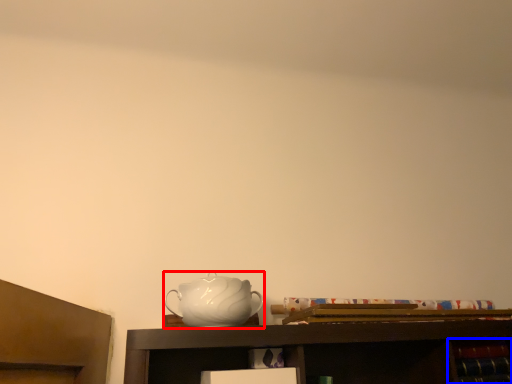
Question: Which object appears farthest to the camera in this image, jug (highlighted by a red box) or cabinet (highlighted by a blue box)?

Choices:
 (A) jug
 (B) cabinet

Answer: (B)